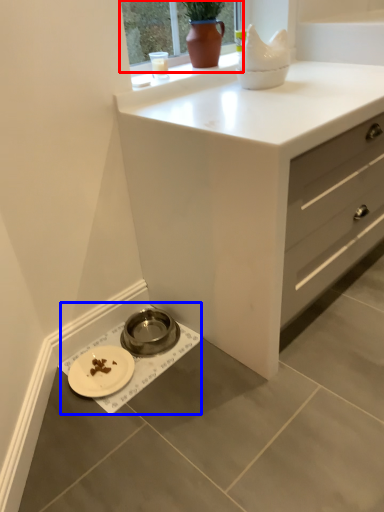
Question: Which point is closer to the camera, window frame (highlighted by a red box) or sink (highlighted by a blue box)?

Choices:
 (A) window frame
 (B) sink

Answer: (A)